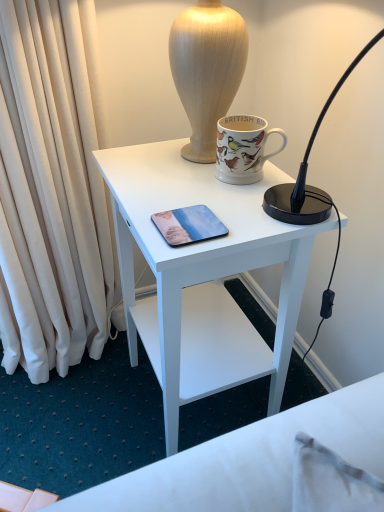
Question: Is metallic glossy phone at center completely or partially inside white matte desk at center?

Choices:
 (A) no
 (B) yes

Answer: (B)

Question: Considering the relative positions of white matte desk at center and metallic glossy phone at center in the image provided, is white matte desk at center behind metallic glossy phone at center?

Choices:
 (A) no
 (B) yes

Answer: (A)

Question: Is metallic glossy phone at center at the back of white matte desk at center?

Choices:
 (A) no
 (B) yes

Answer: (A)

Question: Is white matte desk at center far from metallic glossy phone at center?

Choices:
 (A) yes
 (B) no

Answer: (B)

Question: Does white matte desk at center have a greater height compared to metallic glossy phone at center?

Choices:
 (A) yes
 (B) no

Answer: (A)

Question: In terms of width, does matte ceramic mug at upper center look wider or thinner when compared to white matte desk at center?

Choices:
 (A) thin
 (B) wide

Answer: (A)

Question: From the image's perspective, is matte ceramic mug at upper center located above or below white matte desk at center?

Choices:
 (A) above
 (B) below

Answer: (A)

Question: From their relative heights in the image, would you say matte ceramic mug at upper center is taller or shorter than white matte desk at center?

Choices:
 (A) tall
 (B) short

Answer: (B)

Question: From a real-world perspective, is matte ceramic mug at upper center positioned above or below white matte desk at center?

Choices:
 (A) below
 (B) above

Answer: (B)

Question: Is matte ceramic mug at upper center wider or thinner than metallic glossy phone at center?

Choices:
 (A) thin
 (B) wide

Answer: (A)

Question: Is point (274, 132) closer or farther from the camera than point (173, 243)?

Choices:
 (A) farther
 (B) closer

Answer: (A)

Question: Is matte ceramic mug at upper center spatially inside metallic glossy phone at center, or outside of it?

Choices:
 (A) outside
 (B) inside

Answer: (A)

Question: Relative to metallic glossy phone at center, is matte ceramic mug at upper center in front or behind?

Choices:
 (A) front
 (B) behind

Answer: (B)

Question: From the image's perspective, is metallic glossy phone at center located above or below matte ceramic mug at upper center?

Choices:
 (A) below
 (B) above

Answer: (A)

Question: Do you think metallic glossy phone at center is within matte ceramic mug at upper center, or outside of it?

Choices:
 (A) inside
 (B) outside

Answer: (B)